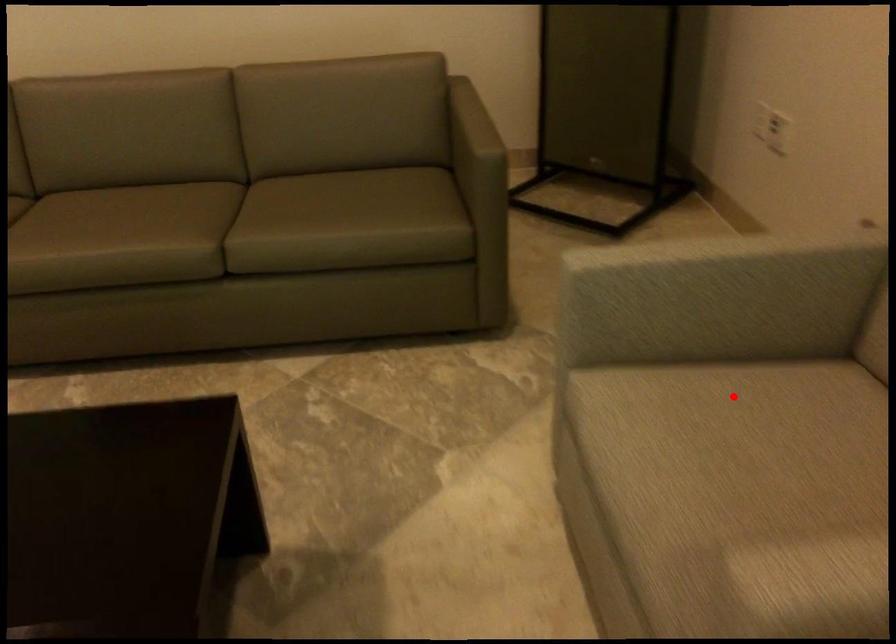
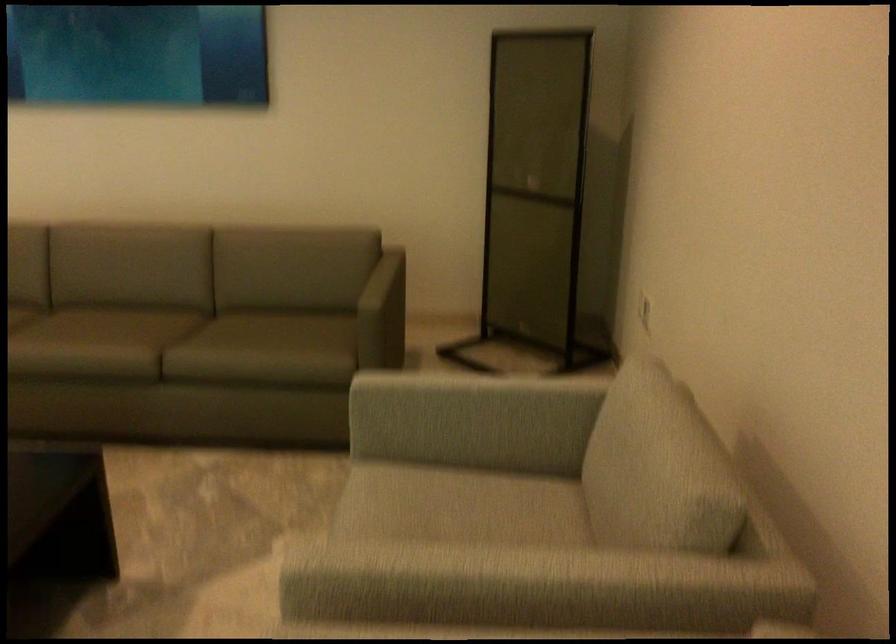
Question: I am providing you with two images of the same scene from different viewpoints. Given a red point in image1, look at the same physical point in image2. Is it:

Choices:
 (A) Closer to the viewpoint
 (B) Farther from the viewpoint

Answer: (B)